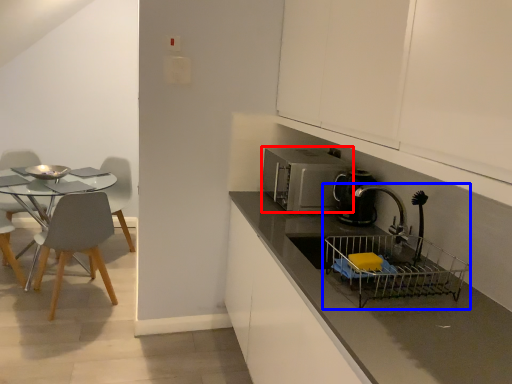
Question: Which object is closer to the camera taking this photo, microwave oven (highlighted by a red box) or sink (highlighted by a blue box)?

Choices:
 (A) microwave oven
 (B) sink

Answer: (B)